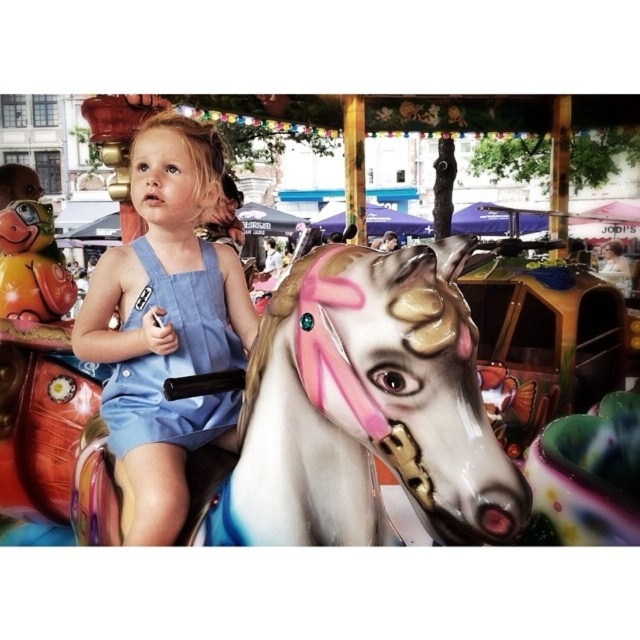
You are a photographer standing at the fairground. You want to take a photo of both the blue denim dress at center and the denim overalls at center. Which one should you focus on first to ensure both are in clear view?

You should focus on the blue denim dress at center first since it is closer to the viewer than the denim overalls at center. By focusing on the closer object, the depth of field may allow the farther denim overalls at center to also be in focus.

You are a photographer trying to capture a photo of the child in the blue denim dress at center and the person in denim overalls at center. You want to ensure both subjects are fully visible in the frame. Which subject should you focus on to ensure the wider coverage?

The blue denim dress at center has a larger width than the denim overalls at center, so focusing on the blue denim dress at center will ensure wider coverage and better visibility for both subjects.

You are a photographer trying to capture the child in the center of the image. The child is wearing a blue denim dress. You have a focus point at point (166, 321). Will this focus point be on the child?

Yes, the focus point at point (166, 321) is on the blue denim dress at center, which the child is wearing, so it will be on the child.